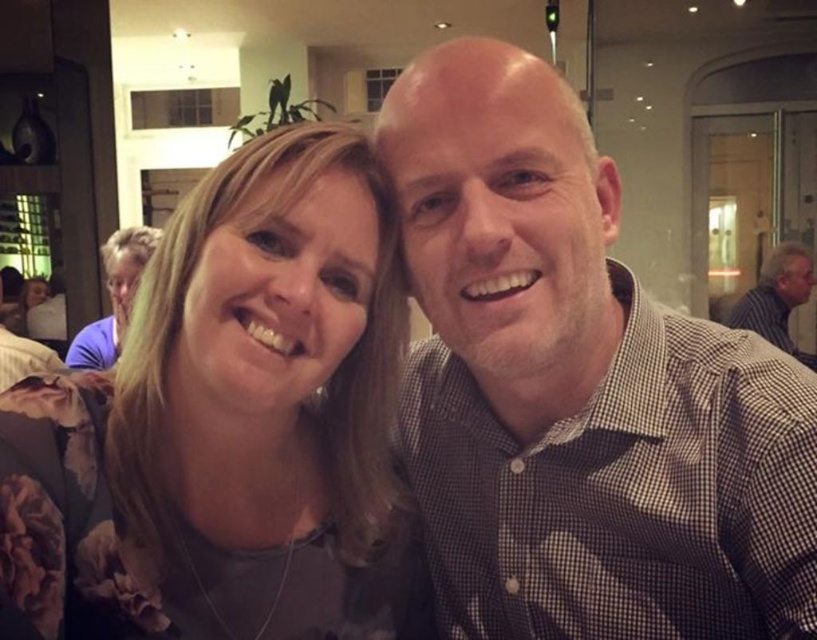
Can you confirm if checkered fabric shirt at center is positioned above floral fabric shirt at left?

Yes, checkered fabric shirt at center is above floral fabric shirt at left.

Is point (543, 148) more distant than point (280, 532)?

No, (543, 148) is closer to viewer.

Between point (416, 170) and point (298, 227), which one is positioned in front?

Point (298, 227) is more forward.

You are a GUI agent. You are given a task and a screenshot of the screen. Output one action in this format:
    pyautogui.click(x=<x>, y=<y>)
    Task: Click on the checkered fabric shirt at center
    The height and width of the screenshot is (640, 817).
    Given the screenshot: What is the action you would take?
    pyautogui.click(x=579, y=388)

Who is lower down, matte purple shirt at upper left or striped shirt at right?

matte purple shirt at upper left is below.

Which is behind, point (150, 234) or point (784, 298)?

The point (784, 298) is more distant.

Is point (92, 326) farther from camera compared to point (789, 244)?

No, (92, 326) is in front of (789, 244).

Image resolution: width=817 pixels, height=640 pixels. In order to click on matte purple shirt at upper left in this screenshot , I will do `click(114, 298)`.

At what (x,y) coordinates should I click in order to perform the action: click on checkered fabric shirt at center. Please return your answer as a coordinate pair (x, y). Looking at the image, I should click on (579, 388).

Who is more forward, (x=630, y=467) or (x=775, y=268)?

Point (x=630, y=467) is in front.

Locate an element on the screen. This screenshot has width=817, height=640. checkered fabric shirt at center is located at coordinates (579, 388).

Identify the location of checkered fabric shirt at center. The height and width of the screenshot is (640, 817). (579, 388).